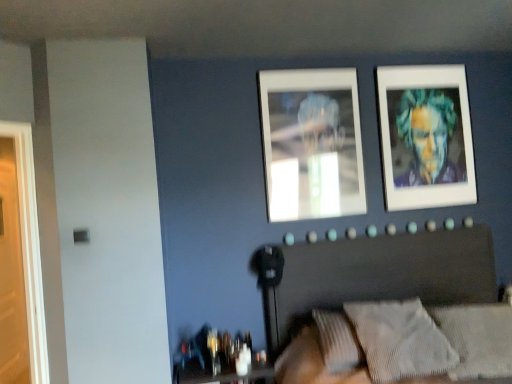
Question: From the image's perspective, relative to metallic reflective frame at upper center, acting as the first picture frame starting from the front, is textured gray headboard at center above or below?

Choices:
 (A) below
 (B) above

Answer: (A)

Question: In terms of height, does textured gray headboard at center look taller or shorter compared to metallic reflective frame at upper center, placed as the 2th picture frame when sorted from right to left?

Choices:
 (A) short
 (B) tall

Answer: (B)

Question: Which of these objects is positioned closest to the textured gray headboard at center?

Choices:
 (A) translucent glass table at lower center
 (B) metallic silver portrait at upper right, which is the first picture frame from right to left
 (C) textured gray pillow at lower right, arranged as the 2th pillow when viewed from the left
 (D) metallic reflective frame at upper center, the 2th picture frame positioned from the back
 (E) textured gray pillow at lower right, arranged as the 1th pillow when viewed from the left

Answer: (E)

Question: Which is farther from the textured gray pillow at lower right, arranged as the 1th pillow when viewed from the left?

Choices:
 (A) translucent glass table at lower center
 (B) textured gray headboard at center
 (C) metallic reflective frame at upper center, placed as the 2th picture frame when sorted from right to left
 (D) metallic silver portrait at upper right, which is the first picture frame from right to left
 (E) textured gray pillow at lower right, marked as the 1th pillow in a right-to-left arrangement

Answer: (D)